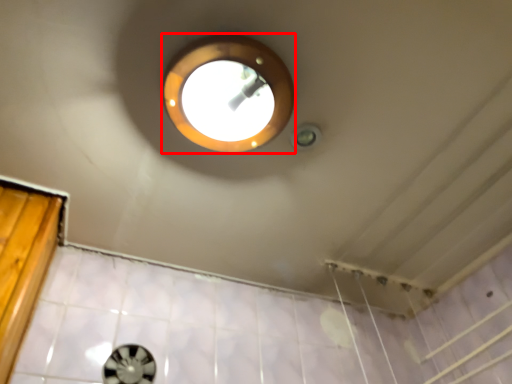
Question: From the image's perspective, where is light (annotated by the red box) located in relation to porthole in the image?

Choices:
 (A) below
 (B) above

Answer: (B)